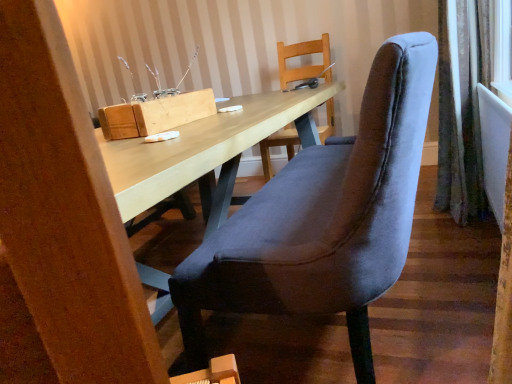
Describe the element at coordinates (461, 107) in the screenshot. This screenshot has height=384, width=512. I see `velvet curtain at right` at that location.

The image size is (512, 384). Find the location of `velvet blue chair at center`. velvet blue chair at center is located at coordinates (324, 218).

Describe the element at coordinates (324, 218) in the screenshot. This screenshot has height=384, width=512. I see `velvet blue chair at center` at that location.

The height and width of the screenshot is (384, 512). Identify the location of velvet curtain at right. (461, 107).

Considering the sizes of objects velvet blue chair at center and velvet curtain at right in the image provided, who is shorter, velvet blue chair at center or velvet curtain at right?

velvet blue chair at center.

What are the coordinates of `chair on the left of the velvet curtain at right` in the screenshot? It's located at (324, 218).

Is the surface of velvet blue chair at center in direct contact with velvet curtain at right?

velvet blue chair at center and velvet curtain at right are not in contact.

Considering the positions of objects velvet blue chair at center and velvet curtain at right in the image provided, who is more to the left, velvet blue chair at center or velvet curtain at right?

velvet blue chair at center is more to the left.

Which object is further away from the camera taking this photo, wooden block at upper center or velvet blue chair at center?

Positioned behind is wooden block at upper center.

Is wooden block at upper center taller than velvet blue chair at center?

Incorrect, the height of wooden block at upper center is not larger of that of velvet blue chair at center.

Is wooden block at upper center completely or partially outside of velvet blue chair at center?

Indeed, wooden block at upper center is completely outside velvet blue chair at center.

Does wooden block at upper center appear on the right side of velvet blue chair at center?

No, wooden block at upper center is not to the right of velvet blue chair at center.

Measure the distance from velvet curtain at right to wooden block at upper center.

They are 1.26 meters apart.

From a real-world perspective, is velvet curtain at right physically above wooden block at upper center?

Actually, velvet curtain at right is physically below wooden block at upper center in the real world.

From the image's perspective, is velvet curtain at right positioned above or below wooden block at upper center?

Clearly, from the image's perspective, velvet curtain at right is above wooden block at upper center.

Find the location of a particular element. Image resolution: width=512 pixels, height=384 pixels. cardboard box on the left of velvet curtain at right is located at coordinates (155, 115).

From a real-world perspective, is velvet curtain at right positioned under velvet blue chair at center based on gravity?

Incorrect, from a real-world perspective, velvet curtain at right is higher than velvet blue chair at center.

Locate an element on the screen. The width and height of the screenshot is (512, 384). curtain to the right of velvet blue chair at center is located at coordinates (461, 107).

Is velvet curtain at right far from velvet blue chair at center?

Yes, velvet curtain at right is far from velvet blue chair at center.

Which is behind, wooden block at upper center or velvet curtain at right?

velvet curtain at right is further away from the camera.

From the image's perspective, is wooden block at upper center located above or below velvet curtain at right?

wooden block at upper center is below velvet curtain at right.

Considering the relative positions of velvet blue chair at center and wooden block at upper center in the image provided, is velvet blue chair at center behind wooden block at upper center?

No, it is in front of wooden block at upper center.

Would you consider velvet blue chair at center to be distant from wooden block at upper center?

No, there isn't a large distance between velvet blue chair at center and wooden block at upper center.

Does velvet blue chair at center turn towards wooden block at upper center?

Yes, velvet blue chair at center is aimed at wooden block at upper center.

Can you confirm if velvet blue chair at center is positioned to the left of wooden block at upper center?

In fact, velvet blue chair at center is to the right of wooden block at upper center.

The height and width of the screenshot is (384, 512). I want to click on chair in front of the velvet curtain at right, so click(324, 218).

Find the location of `chair lying below the wooden block at upper center (from the image's perspective)`. chair lying below the wooden block at upper center (from the image's perspective) is located at coordinates (324, 218).

From the image, which object appears to be farther from wooden block at upper center, velvet blue chair at center or velvet curtain at right?

velvet curtain at right.

Which object lies further to the anchor point velvet curtain at right, wooden block at upper center or velvet blue chair at center?

wooden block at upper center lies further to velvet curtain at right than the other object.

Estimate the real-world distances between objects in this image. Which object is further from velvet blue chair at center, wooden block at upper center or velvet curtain at right?

velvet curtain at right is further to velvet blue chair at center.

From the image, which object appears to be farther from velvet curtain at right, velvet blue chair at center or wooden block at upper center?

wooden block at upper center is further to velvet curtain at right.

When comparing their distances from velvet blue chair at center, does velvet curtain at right or wooden block at upper center seem closer?

Among the two, wooden block at upper center is located nearer to velvet blue chair at center.

Considering their positions, is velvet curtain at right positioned closer to wooden block at upper center than velvet blue chair at center?

velvet blue chair at center.

Where is `chair between wooden block at upper center and velvet curtain at right`? Image resolution: width=512 pixels, height=384 pixels. chair between wooden block at upper center and velvet curtain at right is located at coordinates (324, 218).